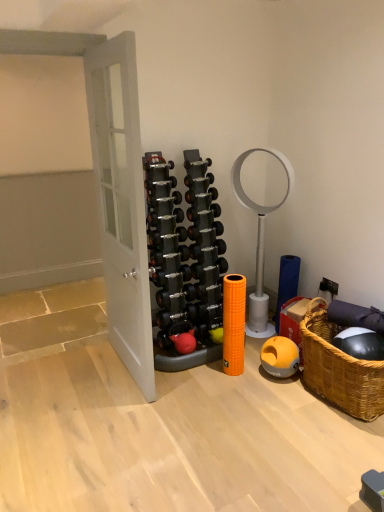
Question: Is point (215, 224) positioned closer to the camera than point (187, 289)?

Choices:
 (A) closer
 (B) farther

Answer: (B)

Question: From their relative heights in the image, would you say black rubber dumbbell at center, marked as the 7th dumbbell in a top-to-bottom arrangement, is taller or shorter than black rubber dumbbell at center, which is the fourteenth dumbbell in top-to-bottom order?

Choices:
 (A) tall
 (B) short

Answer: (B)

Question: Which of these objects is positioned closest to the white matte door at left?

Choices:
 (A) white plastic mirror at center right
 (B) rubberized red kettlebell at center
 (C) black rubber dumbbell at center, which ranks as the 8th dumbbell in bottom-to-top order
 (D) black rubber dumbbell at center, the thirteenth dumbbell positioned from the bottom
 (E) rubberized black dumbbells at center, placed as the tenth dumbbell when sorted from top to bottom

Answer: (E)

Question: Estimate the real-world distances between objects in this image. Which object is farther from the black rubber dumbbell at center, positioned as the fourth dumbbell in top-to-bottom order?

Choices:
 (A) black rubber dumbbell at center, which is the 11th dumbbell from bottom to top
 (B) black rubber dumbbell at center, which ranks as the 9th dumbbell in top-to-bottom order
 (C) black rubber dumbbell at center, which is counted as the fifteenth dumbbell, starting from the bottom
 (D) matte black dumbbell at center, the fifteenth dumbbell viewed from the top
 (E) silver metallic dumbbell at center, which is the 14th dumbbell in bottom-to-top order

Answer: (D)